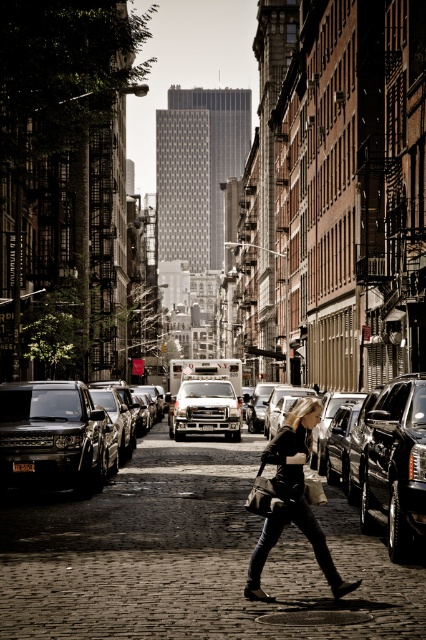
You are a delivery driver who needs to park your vehicle in this street. You see a shiny black suv at right and a white matte van at center. Which vehicle is positioned more to the right side of the street?

The shiny black suv at right is positioned more to the right side of the street than the white matte van at center.

Consider the image. You are a delivery driver who needs to park your shiny black suv at left in a parking spot located at point 0.684, 0.127. Is your vehicle already positioned correctly?

The shiny black suv at left is already positioned at point (54,436), so yes, it is correctly parked there.

You are standing on the street looking up at the buildings. There are two points marked on the image, one at coordinates point [22,404] and the other at point [371,436]. Which point is closer to your eyes?

Point [22,404] is closer to your eyes because it is further to the camera than point [371,436].